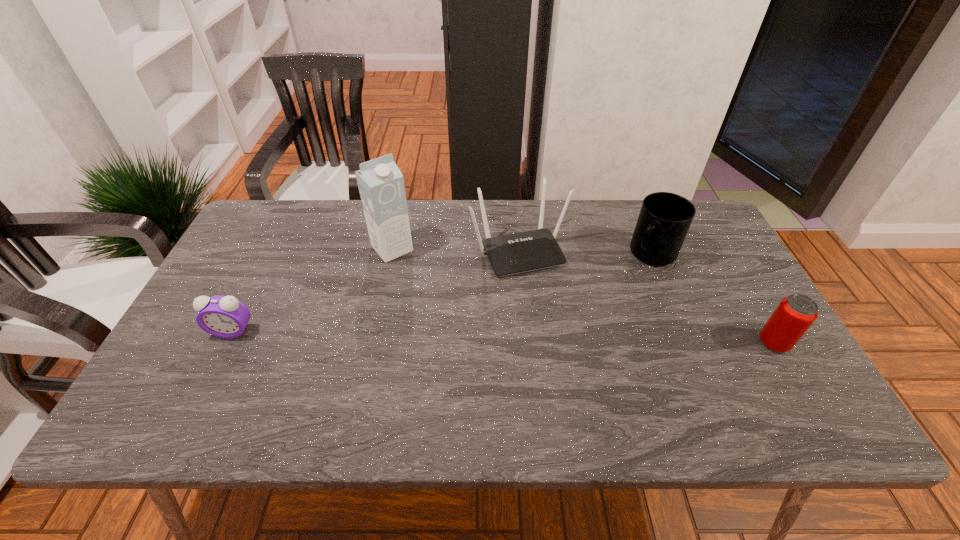
In order to click on vacant spot on the desktop that is between the leftmost object and the rightmost object and is positioned on the front label of the carton in this screenshot , I will do `click(468, 336)`.

Identify the location of free space on the desktop that is between the alarm clock and the rightmost object and is positioned on the front-facing side of the third object from left to right. The height and width of the screenshot is (540, 960). tap(564, 339).

Image resolution: width=960 pixels, height=540 pixels. I want to click on vacant spot on the desktop that is between the alarm clock and the rightmost object and is positioned on the side of the fourth object from left to right with the handle, so click(571, 339).